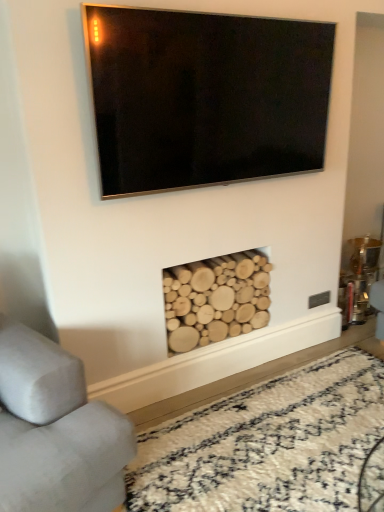
The image size is (384, 512). What are the coordinates of `natural wood logs at lower center` in the screenshot? It's located at (216, 298).

Describe the element at coordinates (54, 429) in the screenshot. The height and width of the screenshot is (512, 384). I see `gray fabric couch at lower left` at that location.

Identify the location of natural wood logs at lower center. This screenshot has height=512, width=384. (267, 444).

In the scene shown: Looking at the image, does gray fabric couch at lower left seem bigger or smaller compared to natural wood logs at lower center?

gray fabric couch at lower left is bigger than natural wood logs at lower center.

Which is in front, point (43, 486) or point (335, 358)?

The point (43, 486) is closer.

From the image's perspective, is gray fabric couch at lower left above or below natural wood logs at lower center?

gray fabric couch at lower left is above natural wood logs at lower center.

Is gray fabric couch at lower left far away from natural wood logs at lower center?

No, gray fabric couch at lower left is not far from natural wood logs at lower center.

Considering the relative positions of natural wood logs at lower center and gray fabric couch at lower left in the image provided, is natural wood logs at lower center to the right of gray fabric couch at lower left from the viewer's perspective?

Correct, you'll find natural wood logs at lower center to the right of gray fabric couch at lower left.

What's the angular difference between natural wood logs at lower center and gray fabric couch at lower left's facing directions?

They differ by 18 degrees in their facing directions.

Based on the photo, is natural wood logs at lower center oriented towards gray fabric couch at lower left?

No, natural wood logs at lower center is not facing towards gray fabric couch at lower left.

Does natural wood logs at lower center have a smaller size compared to gray fabric couch at lower left?

Yes, natural wood logs at lower center is smaller than gray fabric couch at lower left.

Between matte black tv at upper center and natural wood logs at lower center, which one has larger size?

natural wood logs at lower center is bigger.

How distant is matte black tv at upper center from natural wood logs at lower center?

matte black tv at upper center and natural wood logs at lower center are 4.48 feet apart.

The image size is (384, 512). Identify the location of television above the natural wood logs at lower center (from the image's perspective). (205, 97).

Could you tell me if matte black tv at upper center is facing gray fabric couch at lower left?

No, matte black tv at upper center is not oriented towards gray fabric couch at lower left.

Measure the distance from matte black tv at upper center to gray fabric couch at lower left.

A distance of 3.58 feet exists between matte black tv at upper center and gray fabric couch at lower left.

Is matte black tv at upper center placed right next to gray fabric couch at lower left?

No, matte black tv at upper center is not with gray fabric couch at lower left.

Is the depth of matte black tv at upper center greater than that of gray fabric couch at lower left?

Yes, the depth of matte black tv at upper center is greater than that of gray fabric couch at lower left.

Which object is closer to the camera, natural wood logs at lower center or matte black tv at upper center?

matte black tv at upper center is more forward.

Is natural wood logs at lower center positioned with its back to matte black tv at upper center?

No, matte black tv at upper center is not at the back of natural wood logs at lower center.

Based on the photo, are natural wood logs at lower center and matte black tv at upper center far apart?

No, natural wood logs at lower center is not far away from matte black tv at upper center.

Is gray fabric couch at lower left facing towards matte black tv at upper center?

No.

From a real-world perspective, does gray fabric couch at lower left stand above matte black tv at upper center?

No, from a real-world perspective, gray fabric couch at lower left is not over matte black tv at upper center

Who is more distant, gray fabric couch at lower left or matte black tv at upper center?

matte black tv at upper center.

Is gray fabric couch at lower left to the left of natural wood logs at lower center from the viewer's perspective?

Correct, you'll find gray fabric couch at lower left to the left of natural wood logs at lower center.

Does gray fabric couch at lower left touch natural wood logs at lower center?

No.

Is point (2, 468) positioned before point (181, 326)?

That is True.

From the image's perspective, which one is positioned higher, gray fabric couch at lower left or natural wood logs at lower center?

natural wood logs at lower center.

At what (x,y) coordinates should I click in order to perform the action: click on studio couch above the natural wood logs at lower center (from a real-world perspective). Please return your answer as a coordinate pair (x, y). Looking at the image, I should click on (54, 429).

Identify the location of fireplace on the right of gray fabric couch at lower left. (216, 298).

Which object lies nearer to the anchor point gray fabric couch at lower left, matte black tv at upper center or natural wood logs at lower center?

The object closer to gray fabric couch at lower left is natural wood logs at lower center.

Looking at the image, which one is located further to natural wood logs at lower center, natural wood logs at lower center or gray fabric couch at lower left?

gray fabric couch at lower left lies further to natural wood logs at lower center than the other object.

When comparing their distances from natural wood logs at lower center, does gray fabric couch at lower left or matte black tv at upper center seem further?

The object further to natural wood logs at lower center is gray fabric couch at lower left.

When comparing their distances from matte black tv at upper center, does natural wood logs at lower center or natural wood logs at lower center seem closer?

natural wood logs at lower center is closer to matte black tv at upper center.

Considering their positions, is gray fabric couch at lower left positioned closer to matte black tv at upper center than natural wood logs at lower center?

Among the two, gray fabric couch at lower left is located nearer to matte black tv at upper center.

Looking at the image, which one is located further to natural wood logs at lower center, natural wood logs at lower center or gray fabric couch at lower left?

Based on the image, natural wood logs at lower center appears to be further to natural wood logs at lower center.

Estimate the real-world distances between objects in this image. Which object is further from gray fabric couch at lower left, matte black tv at upper center or natural wood logs at lower center?

matte black tv at upper center.

Which object lies further to the anchor point natural wood logs at lower center, matte black tv at upper center or natural wood logs at lower center?

matte black tv at upper center is further to natural wood logs at lower center.

I want to click on fireplace that lies between matte black tv at upper center and gray fabric couch at lower left from top to bottom, so click(x=216, y=298).

Locate an element on the screen. fireplace between gray fabric couch at lower left and natural wood logs at lower center is located at coordinates (216, 298).

Find the location of a particular element. fireplace between matte black tv at upper center and natural wood logs at lower center in the vertical direction is located at coordinates (216, 298).

Where is `studio couch that lies between matte black tv at upper center and natural wood logs at lower center from top to bottom`? Image resolution: width=384 pixels, height=512 pixels. studio couch that lies between matte black tv at upper center and natural wood logs at lower center from top to bottom is located at coordinates (54, 429).